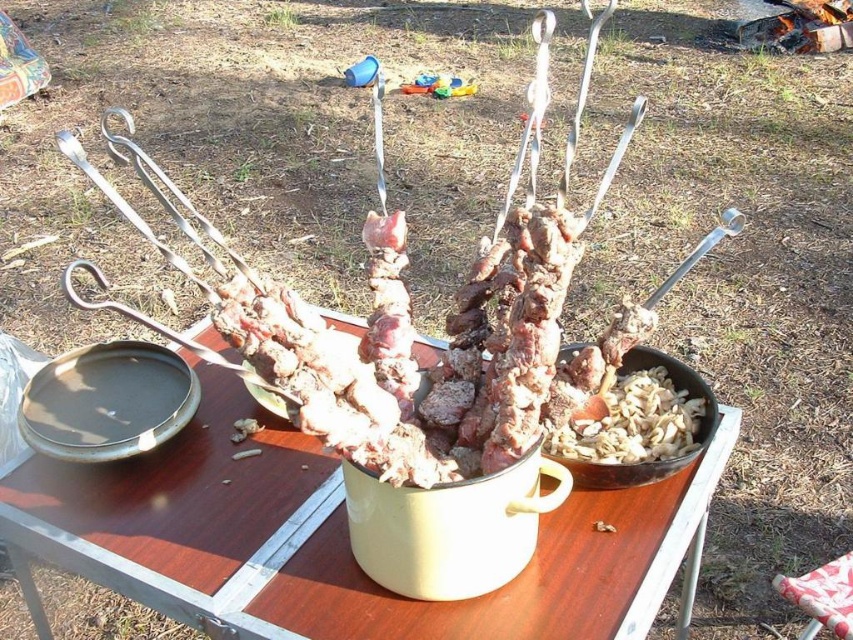
Is white glossy table at center wider than plastic red stool at lower right?

Correct, the width of white glossy table at center exceeds that of plastic red stool at lower right.

Which is behind, point (664, 504) or point (828, 579)?

The point (828, 579) is more distant.

Find the location of `white glossy table at center`. white glossy table at center is located at coordinates (335, 540).